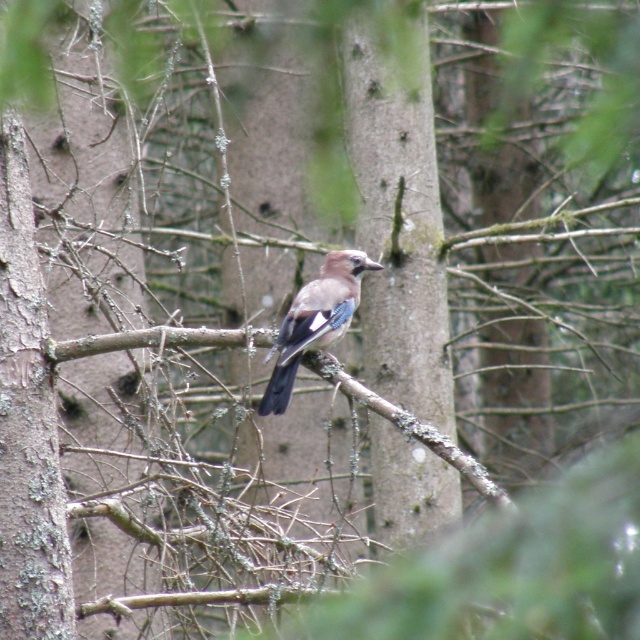
Question: Which object appears farthest from the camera in this image?

Choices:
 (A) blue-gray feathers at center
 (B) brown rough tree trunk at center

Answer: (B)

Question: Can you confirm if brown rough tree trunk at center is smaller than blue-gray feathers at center?

Choices:
 (A) yes
 (B) no

Answer: (B)

Question: Which object appears farthest from the camera in this image?

Choices:
 (A) brown rough tree trunk at center
 (B) blue-gray feathers at center

Answer: (A)

Question: Does brown rough tree trunk at center come in front of blue-gray feathers at center?

Choices:
 (A) yes
 (B) no

Answer: (B)

Question: Observing the image, what is the correct spatial positioning of brown rough tree trunk at center in reference to blue-gray feathers at center?

Choices:
 (A) below
 (B) above

Answer: (B)